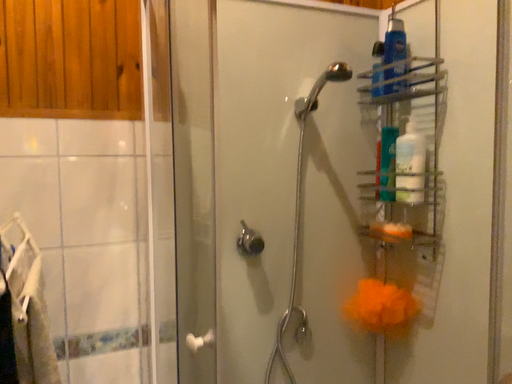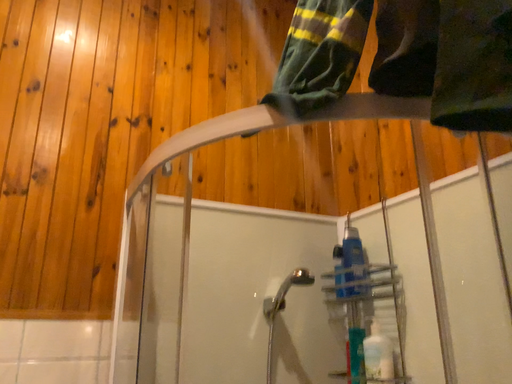
Question: How did the camera likely rotate when shooting the video?

Choices:
 (A) rotated downward
 (B) rotated upward

Answer: (B)